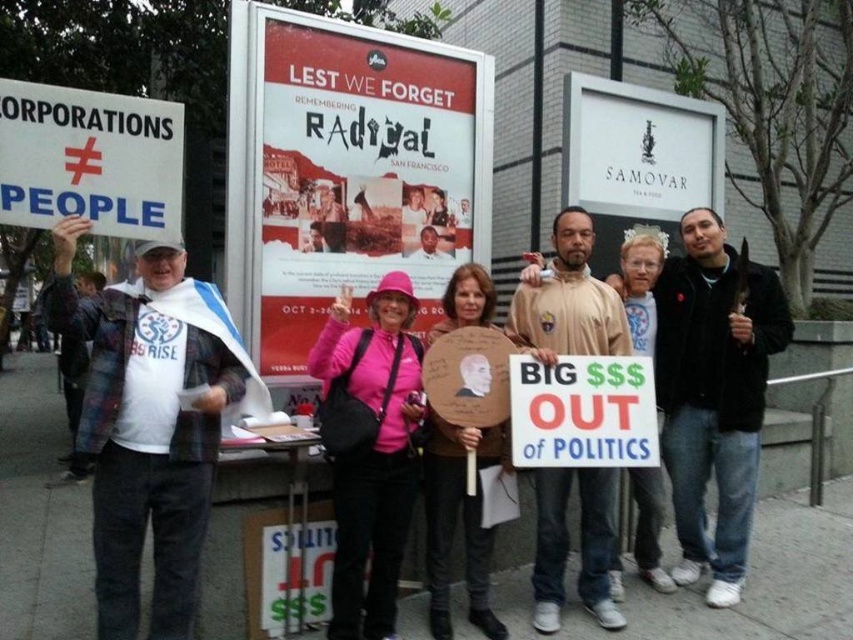
You are a photographer trying to capture a clear shot of the white flannel shirt at left and the white paper sign at left. Which object should you focus on first if you want to ensure both are in focus without adjusting your camera settings?

The white flannel shirt at left is larger in size than the white paper sign at left, so focusing on the larger object first would help maintain focus on both.

You are a photographer standing at the scene. You want to take a photo that includes both the white paper sign at left and the

The white paper sign at left is 2.75 meters from the camera. Since the other sign is closer, you can adjust your position to ensure both signs are in frame.